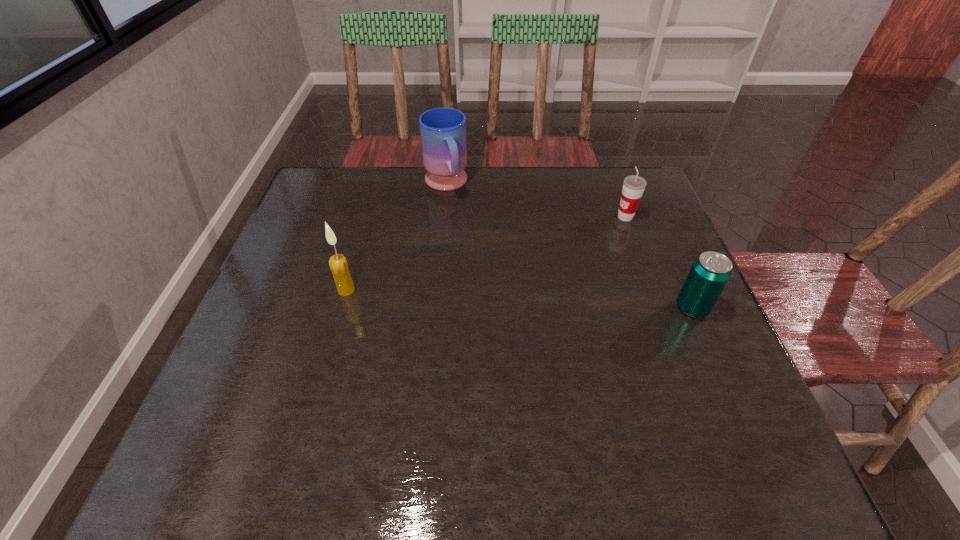
Locate an element on the screen. This screenshot has height=540, width=960. vacant spot on the desktop that is between the leftmost object and the beer can and is positioned on the side of the third object from left to right with the logo is located at coordinates (482, 297).

The height and width of the screenshot is (540, 960). Identify the location of vacant space on the desktop that is between the leftmost object and the rightmost object and is positioned on the side of the mug with the handle. (495, 298).